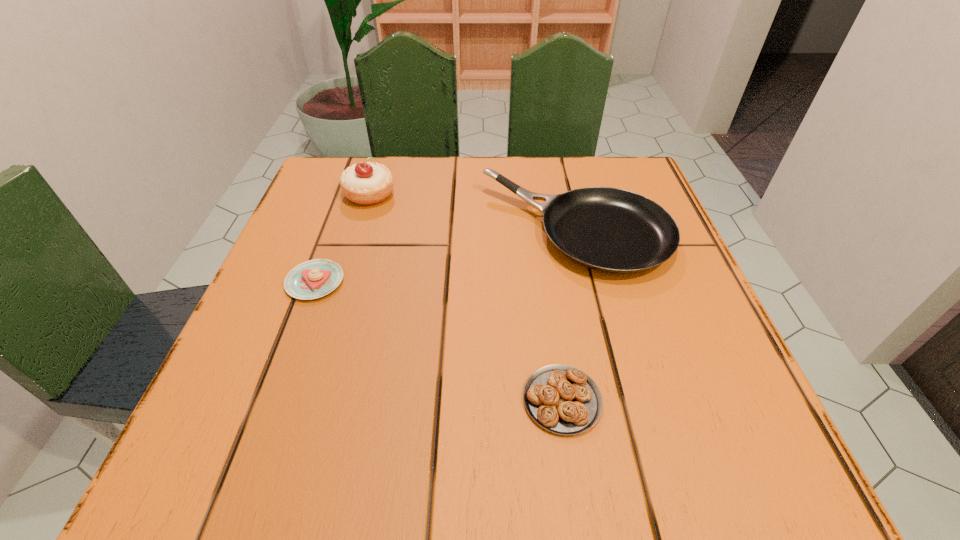
Locate an element on the screen. vacant region between the pan and the second nearest pastry is located at coordinates (445, 256).

The height and width of the screenshot is (540, 960). What are the coordinates of `object that is the second closest to the second nearest pastry` in the screenshot? It's located at (612, 230).

Identify which object is located as the third nearest to the pan. Please provide its 2D coordinates. Your answer should be formatted as a tuple, i.e. [(x, y)], where the tuple contains the x and y coordinates of a point satisfying the conditions above.

[(312, 279)]

Select which pastry is the second closest to the second nearest pastry. Please provide its 2D coordinates. Your answer should be formatted as a tuple, i.e. [(x, y)], where the tuple contains the x and y coordinates of a point satisfying the conditions above.

[(562, 399)]

This screenshot has height=540, width=960. Find the location of `pastry that is the closest to the nearest pastry`. pastry that is the closest to the nearest pastry is located at coordinates (312, 279).

The image size is (960, 540). I want to click on vacant space that satisfies the following two spatial constraints: 1. on the back side of the second nearest pastry; 2. on the right side of the tallest object, so click(348, 194).